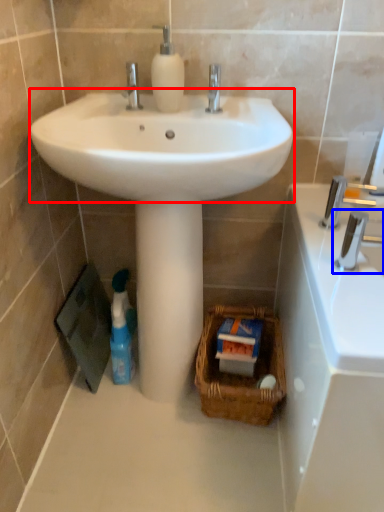
Question: Which point is further to the camera, sink (highlighted by a red box) or tap (highlighted by a blue box)?

Choices:
 (A) sink
 (B) tap

Answer: (B)